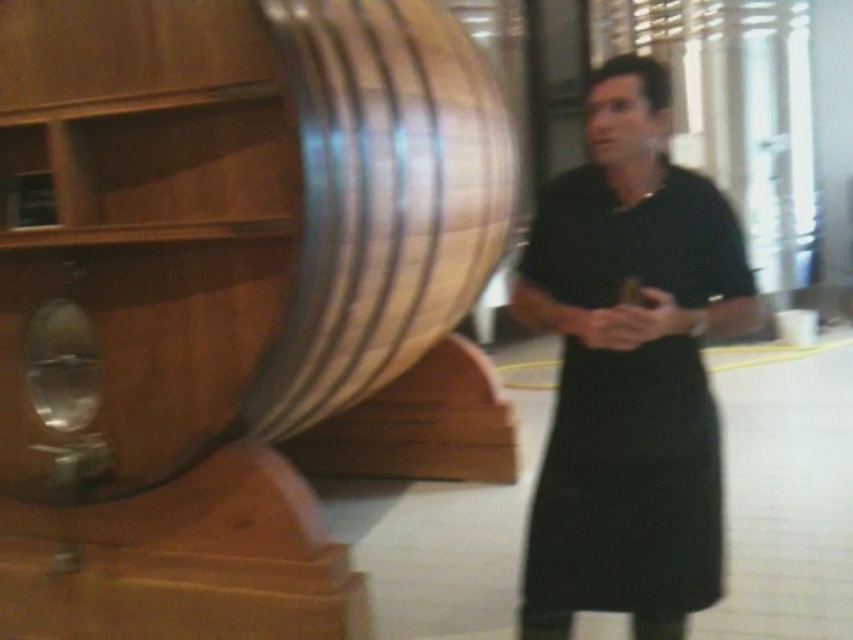
Question: Which point is farther from the camera taking this photo?

Choices:
 (A) (547, 636)
 (B) (77, 26)

Answer: (B)

Question: Is wooden barrel at center in front of black matte apron at center?

Choices:
 (A) yes
 (B) no

Answer: (B)

Question: Can you confirm if wooden barrel at center is positioned to the right of black matte apron at center?

Choices:
 (A) no
 (B) yes

Answer: (A)

Question: Is wooden barrel at center below black matte apron at center?

Choices:
 (A) no
 (B) yes

Answer: (A)